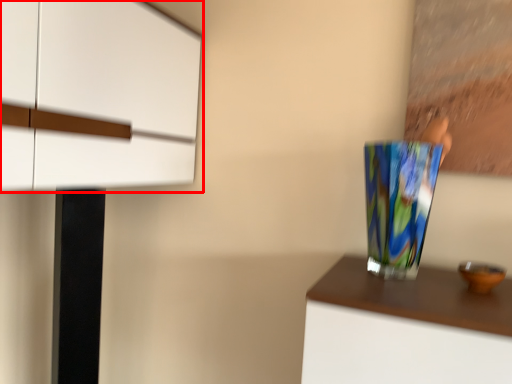
Question: From the image's perspective, considering the relative positions of cabinetry (annotated by the red box) and vase in the image provided, where is cabinetry (annotated by the red box) located with respect to the staircase?

Choices:
 (A) below
 (B) above

Answer: (B)